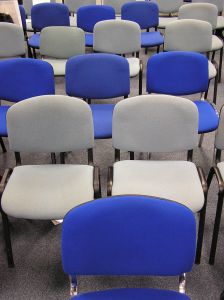
The image size is (224, 300). Find the location of `chairs in second row`. chairs in second row is located at coordinates (59, 133), (151, 131), (219, 140).